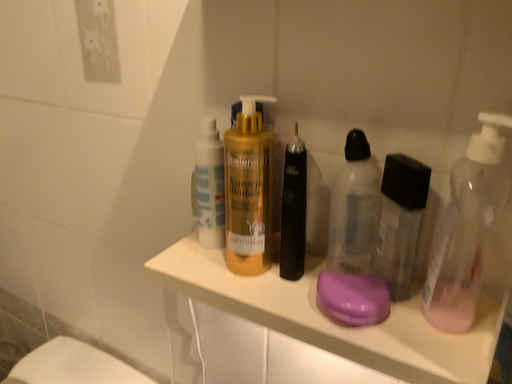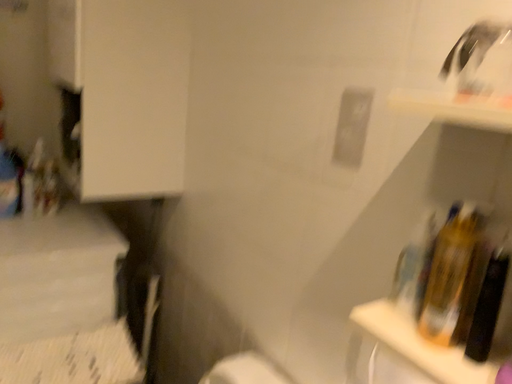
Question: Which way did the camera rotate in the video?

Choices:
 (A) rotated left
 (B) rotated right

Answer: (A)